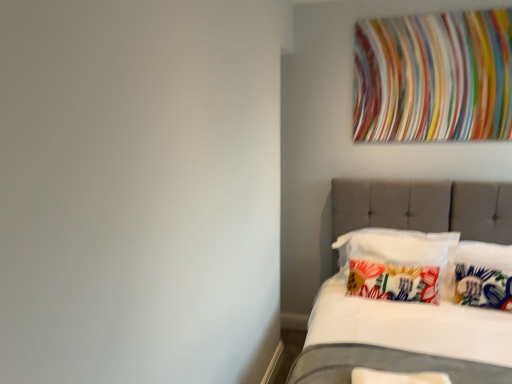
Question: Does white soft pillow at lower right, the 4th pillow in the back-to-front sequence, lie behind tufted fabric bed at right?

Choices:
 (A) no
 (B) yes

Answer: (B)

Question: Can you confirm if white soft pillow at lower right, the 4th pillow in the back-to-front sequence, is taller than tufted fabric bed at right?

Choices:
 (A) yes
 (B) no

Answer: (B)

Question: Can you confirm if white soft pillow at lower right, the 4th pillow in the back-to-front sequence, is thinner than tufted fabric bed at right?

Choices:
 (A) no
 (B) yes

Answer: (B)

Question: Is white soft pillow at lower right, the 4th pillow in the back-to-front sequence, positioned before tufted fabric bed at right?

Choices:
 (A) yes
 (B) no

Answer: (B)

Question: Is white soft pillow at lower right, the 4th pillow in the back-to-front sequence, at the right side of tufted fabric bed at right?

Choices:
 (A) no
 (B) yes

Answer: (A)

Question: Considering the relative sizes of white soft pillow at lower right, marked as the first pillow in a front-to-back arrangement, and tufted fabric bed at right in the image provided, is white soft pillow at lower right, marked as the first pillow in a front-to-back arrangement, shorter than tufted fabric bed at right?

Choices:
 (A) yes
 (B) no

Answer: (A)

Question: From the image's perspective, is floral fabric pillow at center, which is counted as the second pillow, starting from the back, over white soft pillow at lower right, the 4th pillow in the back-to-front sequence?

Choices:
 (A) no
 (B) yes

Answer: (B)

Question: From a real-world perspective, is floral fabric pillow at center, which is counted as the second pillow, starting from the back, under white soft pillow at lower right, the 4th pillow in the back-to-front sequence?

Choices:
 (A) yes
 (B) no

Answer: (B)

Question: Is floral fabric pillow at center, arranged as the third pillow when viewed from the front, turned away from white soft pillow at lower right, the 4th pillow in the back-to-front sequence?

Choices:
 (A) no
 (B) yes

Answer: (A)

Question: Can you confirm if floral fabric pillow at center, arranged as the third pillow when viewed from the front, is bigger than white soft pillow at lower right, the 4th pillow in the back-to-front sequence?

Choices:
 (A) no
 (B) yes

Answer: (B)

Question: Is floral fabric pillow at center, arranged as the third pillow when viewed from the front, taller than white soft pillow at lower right, marked as the first pillow in a front-to-back arrangement?

Choices:
 (A) no
 (B) yes

Answer: (B)

Question: Does floral fabric pillow at center, which is counted as the second pillow, starting from the back, have a greater width compared to white soft pillow at lower right, marked as the first pillow in a front-to-back arrangement?

Choices:
 (A) yes
 (B) no

Answer: (A)

Question: Considering the relative sizes of tufted fabric bed at right and printed fabric pillow at center, positioned as the first pillow in back-to-front order, in the image provided, is tufted fabric bed at right taller than printed fabric pillow at center, positioned as the first pillow in back-to-front order,?

Choices:
 (A) no
 (B) yes

Answer: (B)